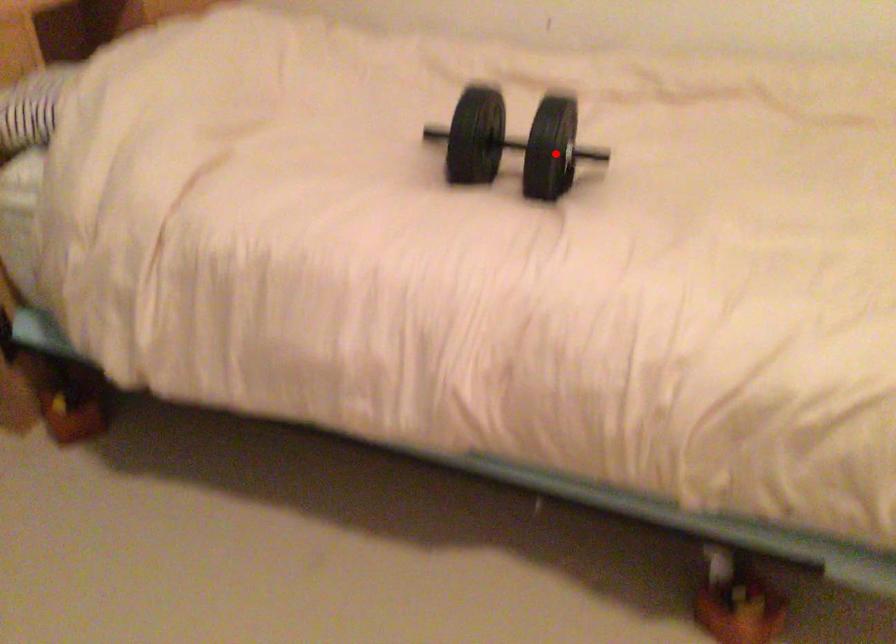
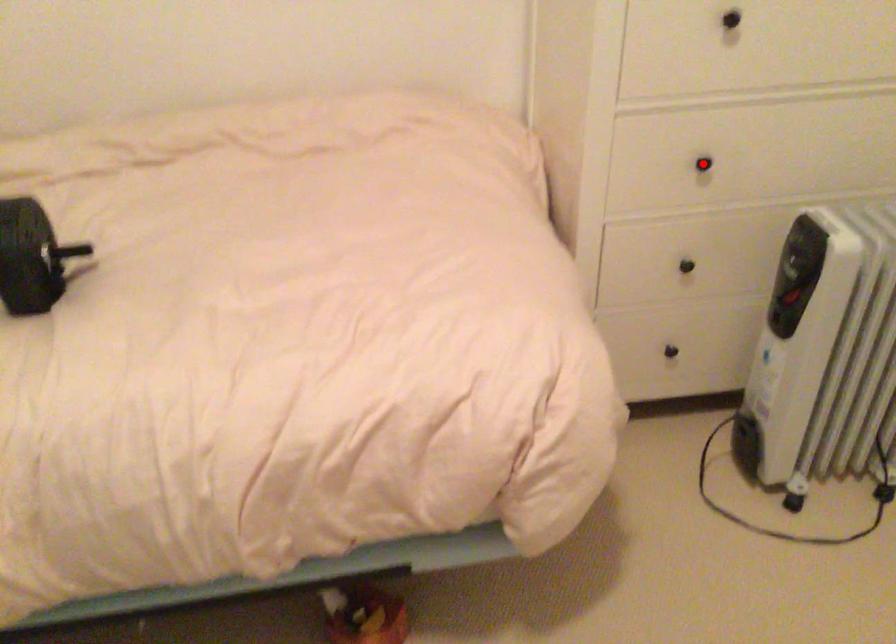
In the scene shown: I am providing you with two images of the same scene from different viewpoints. A red point is marked on the first image and another point is marked on the second image. Is the marked point in image1 the same physical position as the marked point in image2?

No